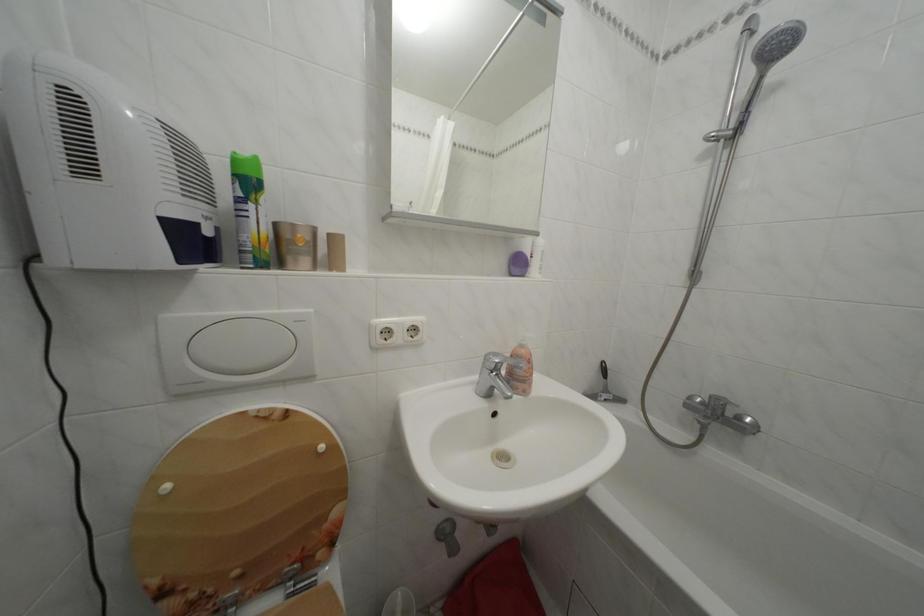
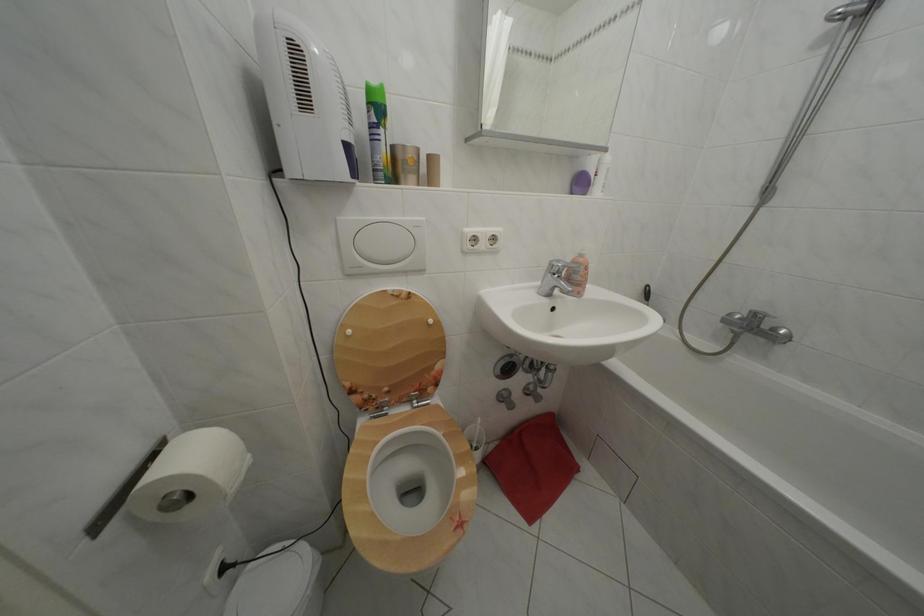
Where in the second image is the point corresponding to point 174,323 from the first image?

(348, 225)